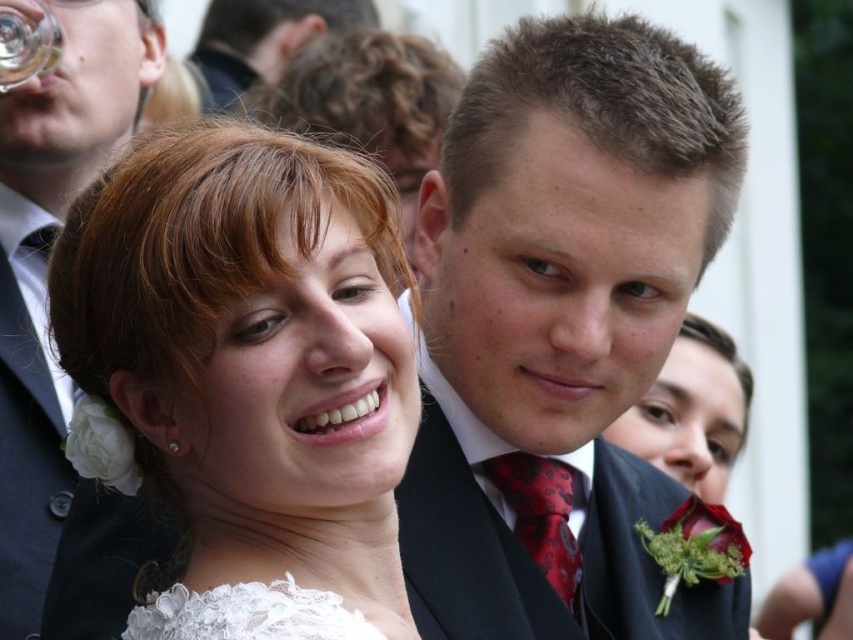
You are a photographer adjusting your camera settings to focus on the transparent glass at upper left. However, you notice the red satin tie at center is also in the frame. Which object is closer to your camera lens? Please answer based on the scene description.

The red satin tie at center is closer to the viewer than the transparent glass at upper left, so the red satin tie at center is closer to the camera lens.

In the scene shown: What is the object located at the coordinates point (x=541, y=516) in the image?

The object located at the coordinates point (x=541, y=516) is the red satin tie at center.

You are a photographer at a wedding and notice two matte black suits in the frame. Which one is closer to you, the photographer, between the matte black suit at center and the matte black suit at upper left?

The matte black suit at center is closer to you because it is in front of the matte black suit at upper left.